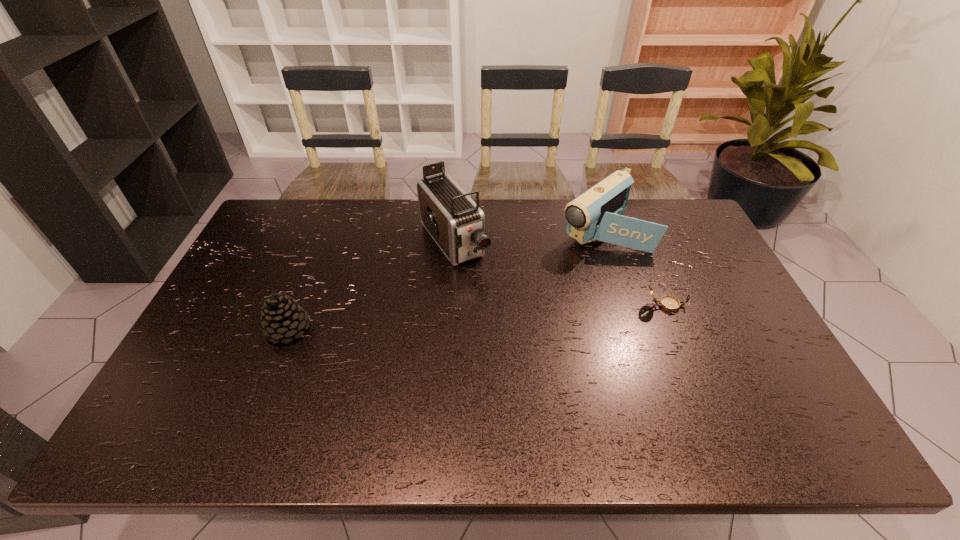
Locate an element on the screen. This screenshot has height=540, width=960. vacant point at the right edge is located at coordinates click(x=702, y=261).

In order to click on free space at the far left corner in this screenshot , I will do `click(307, 213)`.

Find the location of `vacant area at the near left corner`. vacant area at the near left corner is located at coordinates (211, 391).

Where is `vacant region between the compass and the right camcorder`? The height and width of the screenshot is (540, 960). vacant region between the compass and the right camcorder is located at coordinates (634, 267).

Identify the location of empty location between the shortest object and the pinecone. This screenshot has width=960, height=540. (477, 318).

The width and height of the screenshot is (960, 540). Identify the location of free point between the shortest object and the third shortest object. (634, 267).

Where is `vacant space that's between the nearest object and the compass`? This screenshot has width=960, height=540. vacant space that's between the nearest object and the compass is located at coordinates (477, 318).

Locate an element on the screen. This screenshot has width=960, height=540. free area in between the leftmost object and the shorter camcorder is located at coordinates (445, 279).

Locate an element on the screen. The width and height of the screenshot is (960, 540). blank region between the compass and the right camcorder is located at coordinates (634, 267).

Identify the location of unoccupied position between the shortest object and the nearest object. This screenshot has width=960, height=540. (477, 318).